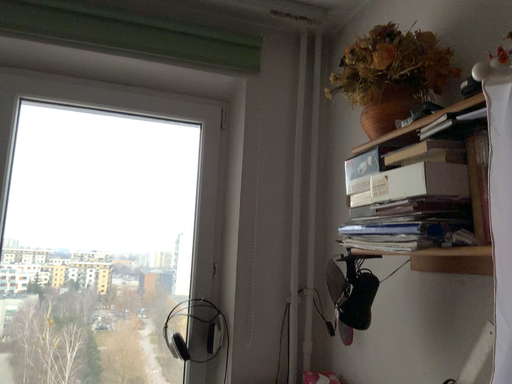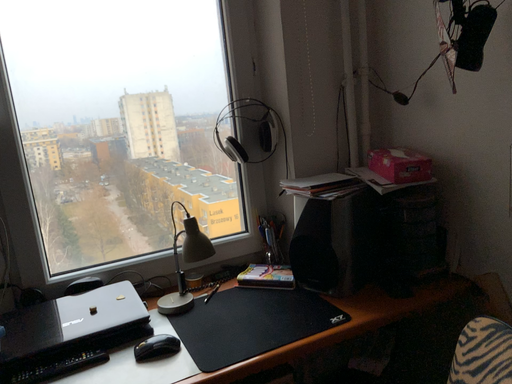
Question: How did the camera likely rotate when shooting the video?

Choices:
 (A) rotated downward
 (B) rotated upward

Answer: (A)